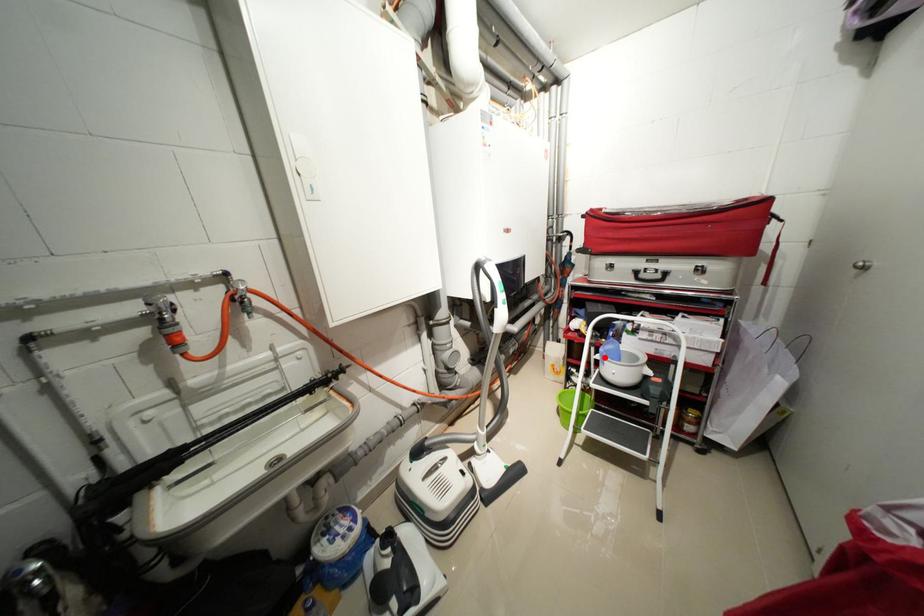
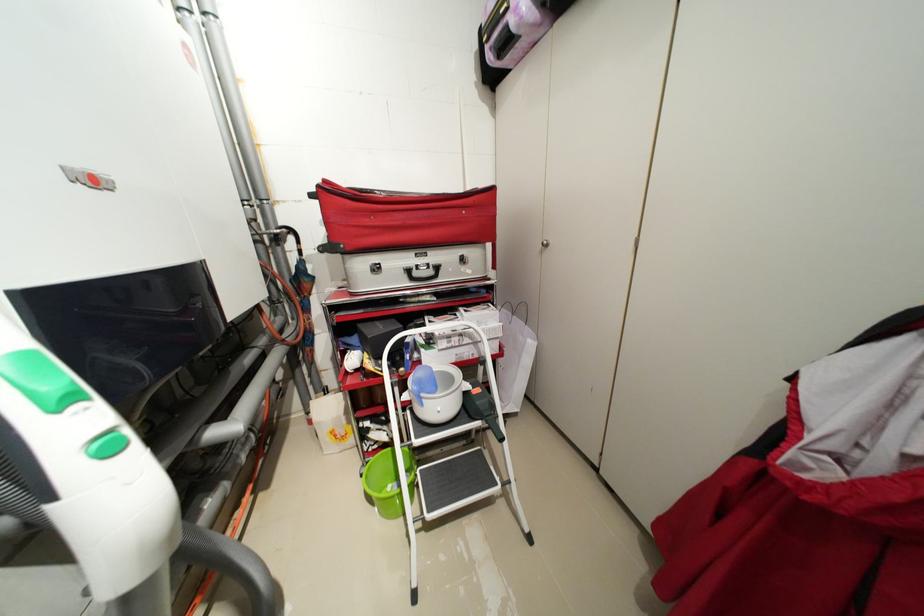
In the second image, find the point that corresponds to the highlighted location in the first image.

(412, 398)